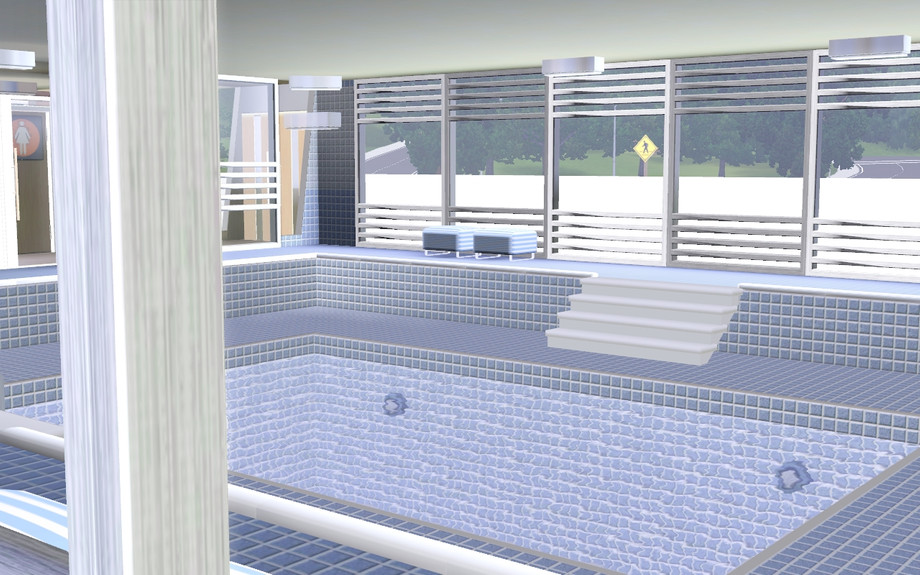
Image resolution: width=920 pixels, height=575 pixels. What are the coordinates of `indoor pool` in the screenshot? It's located at (470, 451).